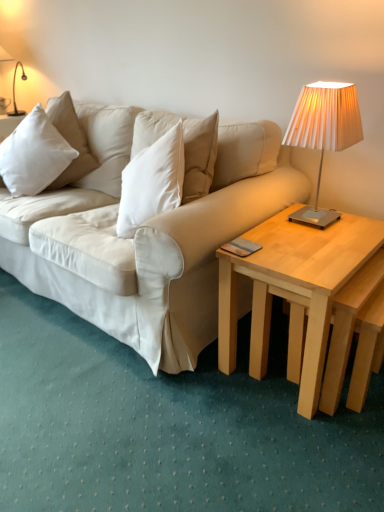
This screenshot has height=512, width=384. In order to click on light wood/natural wood coffee table at right in this screenshot , I will do `click(293, 291)`.

This screenshot has height=512, width=384. I want to click on metallic pleated lampshade at upper right, so click(x=324, y=133).

In the scene shown: Measure the distance between metallic pleated lampshade at upper right and camera.

4.42 feet.

Locate an element on the screen. light wood/natural wood coffee table at right is located at coordinates (293, 291).

From the image's perspective, is metallic pleated lampshade at upper right beneath light wood/natural wood coffee table at right?

No, from the image's perspective, metallic pleated lampshade at upper right is not below light wood/natural wood coffee table at right.

Does point (346, 133) lie behind point (236, 264)?

Yes, it is behind point (236, 264).

Is metallic pleated lampshade at upper right oriented towards light wood/natural wood coffee table at right?

No.

Can you tell me how much metallic pleated lampshade at upper right and light wood/natural wood coffee table at right differ in facing direction?

The facing directions of metallic pleated lampshade at upper right and light wood/natural wood coffee table at right are 0.000282 degrees apart.

Is point (311, 106) closer or farther from the camera than point (68, 146)?

Point (311, 106) is closer to the camera than point (68, 146).

Is metallic pleated lampshade at upper right facing away from white soft pillow at left?

No, metallic pleated lampshade at upper right is not facing the opposite direction of white soft pillow at left.

Is metallic pleated lampshade at upper right not inside white soft pillow at left?

Indeed, metallic pleated lampshade at upper right is completely outside white soft pillow at left.

Who is more distant, metallic pleated lampshade at upper right or white soft pillow at left?

white soft pillow at left.

How different are the orientations of light wood/natural wood coffee table at right and metallic pleated lampshade at upper right in degrees?

0.000282 degrees separate the facing orientations of light wood/natural wood coffee table at right and metallic pleated lampshade at upper right.

Can you confirm if light wood/natural wood coffee table at right is bigger than metallic pleated lampshade at upper right?

Yes, light wood/natural wood coffee table at right is bigger than metallic pleated lampshade at upper right.

Is light wood/natural wood coffee table at right positioned before metallic pleated lampshade at upper right?

Yes, light wood/natural wood coffee table at right is closer to the camera.

Does light wood/natural wood coffee table at right contain metallic pleated lampshade at upper right?

No, metallic pleated lampshade at upper right is not inside light wood/natural wood coffee table at right.

Does light wood/natural wood coffee table at right turn towards white soft pillow at left?

No, light wood/natural wood coffee table at right is not oriented towards white soft pillow at left.

Which is more to the right, light wood/natural wood coffee table at right or white soft pillow at left?

From the viewer's perspective, light wood/natural wood coffee table at right appears more on the right side.

Can you confirm if light wood/natural wood coffee table at right is bigger than white soft pillow at left?

Yes, light wood/natural wood coffee table at right is bigger than white soft pillow at left.

Between point (32, 188) and point (325, 251), which one is positioned behind?

The point (32, 188) is behind.

From a real-world perspective, which object stands above the other?

white soft pillow at left, from a real-world perspective.

Which object is positioned more to the left, white soft pillow at left or light wood/natural wood coffee table at right?

Positioned to the left is white soft pillow at left.

Which is more to the right, white soft pillow at left or metallic pleated lampshade at upper right?

Positioned to the right is metallic pleated lampshade at upper right.

Locate an element on the screen. The width and height of the screenshot is (384, 512). pillow behind the metallic pleated lampshade at upper right is located at coordinates (34, 155).

Which object is thinner, white soft pillow at left or metallic pleated lampshade at upper right?

With smaller width is metallic pleated lampshade at upper right.

What's the angular difference between white soft pillow at left and metallic pleated lampshade at upper right's facing directions?

The angle between the facing direction of white soft pillow at left and the facing direction of metallic pleated lampshade at upper right is 24.4 degrees.

The height and width of the screenshot is (512, 384). Identify the location of coffee table below the metallic pleated lampshade at upper right (from a real-world perspective). (293, 291).

Where is `pillow lying on the left of metallic pleated lampshade at upper right`? The height and width of the screenshot is (512, 384). pillow lying on the left of metallic pleated lampshade at upper right is located at coordinates (34, 155).

Looking at the image, which one is located closer to light wood/natural wood coffee table at right, metallic pleated lampshade at upper right or white soft pillow at left?

metallic pleated lampshade at upper right.

Considering their positions, is metallic pleated lampshade at upper right positioned closer to white soft pillow at left than light wood/natural wood coffee table at right?

Based on the image, metallic pleated lampshade at upper right appears to be nearer to white soft pillow at left.

In the scene shown: Based on their spatial positions, is light wood/natural wood coffee table at right or white soft pillow at left closer to metallic pleated lampshade at upper right?

light wood/natural wood coffee table at right.

Looking at this image, looking at the image, which one is located further to light wood/natural wood coffee table at right, white soft pillow at left or metallic pleated lampshade at upper right?

white soft pillow at left.

Which object lies further to the anchor point metallic pleated lampshade at upper right, white soft pillow at left or light wood/natural wood coffee table at right?

white soft pillow at left is positioned further to the anchor metallic pleated lampshade at upper right.

From the image, which object appears to be farther from white soft pillow at left, light wood/natural wood coffee table at right or metallic pleated lampshade at upper right?

light wood/natural wood coffee table at right is further to white soft pillow at left.

This screenshot has width=384, height=512. What are the coordinates of `coffee table between white soft pillow at left and metallic pleated lampshade at upper right from left to right` in the screenshot? It's located at (293, 291).